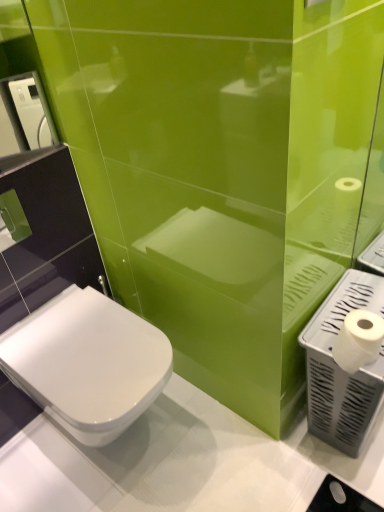
This screenshot has width=384, height=512. Describe the element at coordinates (87, 362) in the screenshot. I see `white glossy toilet at lower left` at that location.

This screenshot has height=512, width=384. I want to click on white plastic hand dryer at right, which is the second hand dryer in top-to-bottom order, so click(x=341, y=369).

What do you see at coordinates (358, 340) in the screenshot?
I see `white matte toilet paper at right` at bounding box center [358, 340].

Where is `white glossy toilet at lower left`? white glossy toilet at lower left is located at coordinates (87, 362).

From a real-world perspective, is white plastic hand dryer at upper left, positioned as the second hand dryer in bottom-to-top order, under white plastic hand dryer at right, the 1th hand dryer from the right?

No, from a real-world perspective, white plastic hand dryer at upper left, positioned as the second hand dryer in bottom-to-top order, is not under white plastic hand dryer at right, the 1th hand dryer from the right.

Where is `hand dryer in front of the white plastic hand dryer at upper left, positioned as the second hand dryer in bottom-to-top order`? hand dryer in front of the white plastic hand dryer at upper left, positioned as the second hand dryer in bottom-to-top order is located at coordinates (341, 369).

In terms of height, does white plastic hand dryer at upper left, the second hand dryer from the right, look taller or shorter compared to white plastic hand dryer at right, the first hand dryer in the bottom-to-top sequence?

In the image, white plastic hand dryer at upper left, the second hand dryer from the right, appears to be shorter than white plastic hand dryer at right, the first hand dryer in the bottom-to-top sequence.

Does point (31, 111) lie behind point (358, 387)?

That is True.

Considering the points (351, 369) and (8, 130), which point is in front, point (351, 369) or point (8, 130)?

Point (351, 369)

Which object is positioned more to the right, white matte toilet paper at right or white plastic hand dryer at upper left, which is the first hand dryer from left to right?

white matte toilet paper at right.

Can we say white matte toilet paper at right lies outside white plastic hand dryer at upper left, which is the first hand dryer from left to right?

Yes, white matte toilet paper at right is not within white plastic hand dryer at upper left, which is the first hand dryer from left to right.

From a real-world perspective, which is physically above, white matte toilet paper at right or white plastic hand dryer at upper left, which ranks as the first hand dryer in top-to-bottom order?

In real-world perspective, white plastic hand dryer at upper left, which ranks as the first hand dryer in top-to-bottom order, is above.

Does white plastic hand dryer at right, the 1th hand dryer from the right, come in front of white plastic hand dryer at upper left, which is the first hand dryer from left to right?

Yes, the depth of white plastic hand dryer at right, the 1th hand dryer from the right, is less than that of white plastic hand dryer at upper left, which is the first hand dryer from left to right.

From the image's perspective, is white plastic hand dryer at right, the first hand dryer in the bottom-to-top sequence, above or below white plastic hand dryer at upper left, positioned as the second hand dryer in bottom-to-top order?

Clearly, from the image's perspective, white plastic hand dryer at right, the first hand dryer in the bottom-to-top sequence, is below white plastic hand dryer at upper left, positioned as the second hand dryer in bottom-to-top order.

Is point (376, 362) less distant than point (19, 132)?

Yes, point (376, 362) is in front of point (19, 132).

Which is behind, point (50, 343) or point (317, 316)?

Positioned behind is point (50, 343).

Is white glossy toilet at lower left not within white plastic hand dryer at right, which is the second hand dryer in top-to-bottom order?

Yes, white glossy toilet at lower left is outside of white plastic hand dryer at right, which is the second hand dryer in top-to-bottom order.

This screenshot has height=512, width=384. I want to click on toilet located above the white plastic hand dryer at right, the second hand dryer in the left-to-right sequence (from a real-world perspective), so click(87, 362).

Consider the image. Which object is closer to the camera taking this photo, white glossy toilet at lower left or white plastic hand dryer at right, the second hand dryer in the left-to-right sequence?

white glossy toilet at lower left.

Measure the distance between white glossy toilet at lower left and white matte toilet paper at right.

The distance of white glossy toilet at lower left from white matte toilet paper at right is 26.72 inches.

From a real-world perspective, is white glossy toilet at lower left below white matte toilet paper at right?

Yes, from a real-world perspective, white glossy toilet at lower left is below white matte toilet paper at right.

From the picture: How different are the orientations of white glossy toilet at lower left and white matte toilet paper at right in degrees?

0.000318 degrees separate the facing orientations of white glossy toilet at lower left and white matte toilet paper at right.

Between point (88, 320) and point (365, 339), which one is positioned in front?

The point (365, 339) is closer.

Considering the relative sizes of white glossy toilet at lower left and white plastic hand dryer at upper left, positioned as the second hand dryer in bottom-to-top order, in the image provided, is white glossy toilet at lower left shorter than white plastic hand dryer at upper left, positioned as the second hand dryer in bottom-to-top order,?

In fact, white glossy toilet at lower left may be taller than white plastic hand dryer at upper left, positioned as the second hand dryer in bottom-to-top order.

Which object is wider, white glossy toilet at lower left or white plastic hand dryer at upper left, which is the first hand dryer from left to right?

white glossy toilet at lower left.

Based on the photo, considering the positions of objects white glossy toilet at lower left and white plastic hand dryer at upper left, positioned as the second hand dryer in bottom-to-top order, in the image provided, who is behind, white glossy toilet at lower left or white plastic hand dryer at upper left, positioned as the second hand dryer in bottom-to-top order,?

white plastic hand dryer at upper left, positioned as the second hand dryer in bottom-to-top order, is further away from the camera.

Can we say white glossy toilet at lower left lies outside white plastic hand dryer at upper left, which is the first hand dryer from left to right?

Yes.

In the scene shown: Between white plastic hand dryer at upper left, which ranks as the first hand dryer in top-to-bottom order, and white glossy toilet at lower left, which one has smaller width?

white plastic hand dryer at upper left, which ranks as the first hand dryer in top-to-bottom order.

Considering the positions of point (4, 96) and point (68, 359), is point (4, 96) closer or farther from the camera than point (68, 359)?

Point (4, 96) appears to be farther away from the viewer than point (68, 359).

How many degrees apart are the facing directions of white plastic hand dryer at upper left, which is the first hand dryer from left to right, and white glossy toilet at lower left?

There is a 23.5-degree angle between the facing directions of white plastic hand dryer at upper left, which is the first hand dryer from left to right, and white glossy toilet at lower left.

Does white plastic hand dryer at upper left, positioned as the second hand dryer in bottom-to-top order, have a lesser height compared to white glossy toilet at lower left?

Indeed, white plastic hand dryer at upper left, positioned as the second hand dryer in bottom-to-top order, has a lesser height compared to white glossy toilet at lower left.

Image resolution: width=384 pixels, height=512 pixels. Identify the location of hand dryer on the right of the white plastic hand dryer at upper left, which ranks as the first hand dryer in top-to-bottom order. (341, 369).

You are a GUI agent. You are given a task and a screenshot of the screen. Output one action in this format:
    pyautogui.click(x=<x>, y=<y>)
    Task: Click on the hand dryer above the white matte toilet paper at right (from the image's perspective)
    The height and width of the screenshot is (512, 384).
    Given the screenshot: What is the action you would take?
    pyautogui.click(x=24, y=115)

Based on their spatial positions, is white glossy toilet at lower left or white plastic hand dryer at right, the 1th hand dryer from the right, further from white plastic hand dryer at upper left, which ranks as the first hand dryer in top-to-bottom order?

white plastic hand dryer at right, the 1th hand dryer from the right, is positioned further to the anchor white plastic hand dryer at upper left, which ranks as the first hand dryer in top-to-bottom order.

Based on their spatial positions, is white plastic hand dryer at upper left, which is the first hand dryer from left to right, or white glossy toilet at lower left further from white matte toilet paper at right?

Among the two, white plastic hand dryer at upper left, which is the first hand dryer from left to right, is located further to white matte toilet paper at right.

Which object lies further to the anchor point white plastic hand dryer at upper left, which ranks as the first hand dryer in top-to-bottom order, white matte toilet paper at right or white glossy toilet at lower left?

Among the two, white matte toilet paper at right is located further to white plastic hand dryer at upper left, which ranks as the first hand dryer in top-to-bottom order.

Which object lies further to the anchor point white plastic hand dryer at right, the first hand dryer in the bottom-to-top sequence, white glossy toilet at lower left or white plastic hand dryer at upper left, positioned as the second hand dryer in bottom-to-top order?

white plastic hand dryer at upper left, positioned as the second hand dryer in bottom-to-top order.

Which object lies further to the anchor point white glossy toilet at lower left, white plastic hand dryer at right, which is the second hand dryer in top-to-bottom order, or white plastic hand dryer at upper left, which is the first hand dryer from left to right?

white plastic hand dryer at upper left, which is the first hand dryer from left to right, is further to white glossy toilet at lower left.

When comparing their distances from white matte toilet paper at right, does white plastic hand dryer at right, the second hand dryer in the left-to-right sequence, or white glossy toilet at lower left seem closer?

Among the two, white plastic hand dryer at right, the second hand dryer in the left-to-right sequence, is located nearer to white matte toilet paper at right.

Which object lies nearer to the anchor point white glossy toilet at lower left, white matte toilet paper at right or white plastic hand dryer at right, the 1th hand dryer from the right?

The object closer to white glossy toilet at lower left is white plastic hand dryer at right, the 1th hand dryer from the right.

Looking at the image, which one is located closer to white plastic hand dryer at right, the second hand dryer in the left-to-right sequence, white matte toilet paper at right or white plastic hand dryer at upper left, which is the first hand dryer from left to right?

white matte toilet paper at right lies closer to white plastic hand dryer at right, the second hand dryer in the left-to-right sequence, than the other object.

Where is `toilet paper between white plastic hand dryer at upper left, positioned as the second hand dryer in bottom-to-top order, and white plastic hand dryer at right, the second hand dryer in the left-to-right sequence, in the horizontal direction`? This screenshot has height=512, width=384. toilet paper between white plastic hand dryer at upper left, positioned as the second hand dryer in bottom-to-top order, and white plastic hand dryer at right, the second hand dryer in the left-to-right sequence, in the horizontal direction is located at coordinates (358, 340).

Identify the location of toilet paper between white glossy toilet at lower left and white plastic hand dryer at right, the second hand dryer in the left-to-right sequence, from left to right. (358, 340).

The height and width of the screenshot is (512, 384). What are the coordinates of `toilet situated between white plastic hand dryer at upper left, the second hand dryer from the right, and white matte toilet paper at right from left to right` in the screenshot? It's located at (87, 362).

Image resolution: width=384 pixels, height=512 pixels. Find the location of `toilet between white plastic hand dryer at upper left, the second hand dryer from the right, and white plastic hand dryer at right, the second hand dryer in the left-to-right sequence, from left to right`. toilet between white plastic hand dryer at upper left, the second hand dryer from the right, and white plastic hand dryer at right, the second hand dryer in the left-to-right sequence, from left to right is located at coordinates (87, 362).